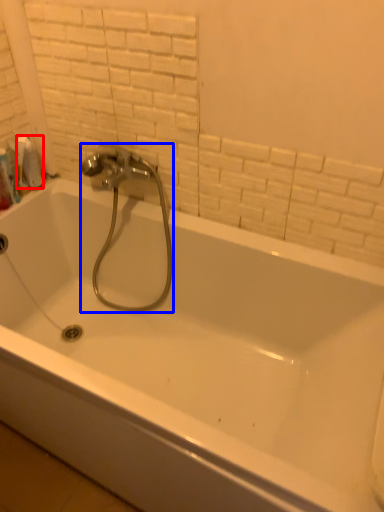
Question: Among these objects, which one is farthest to the camera, toilet paper (highlighted by a red box) or plumbing fixture (highlighted by a blue box)?

Choices:
 (A) toilet paper
 (B) plumbing fixture

Answer: (A)